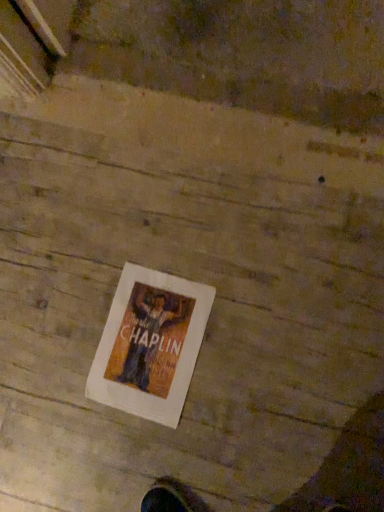
I want to click on free location to the right of white paper poster at center, so click(241, 289).